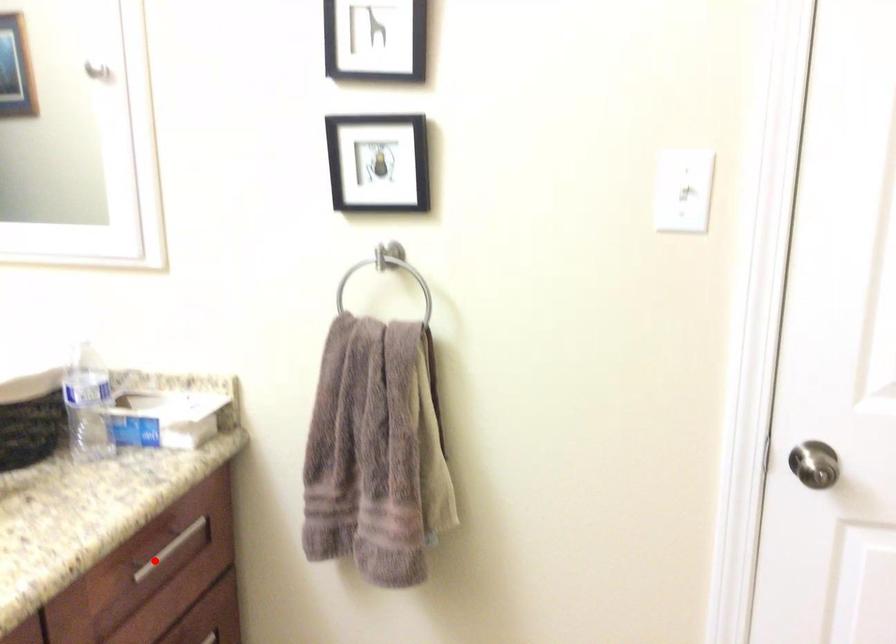
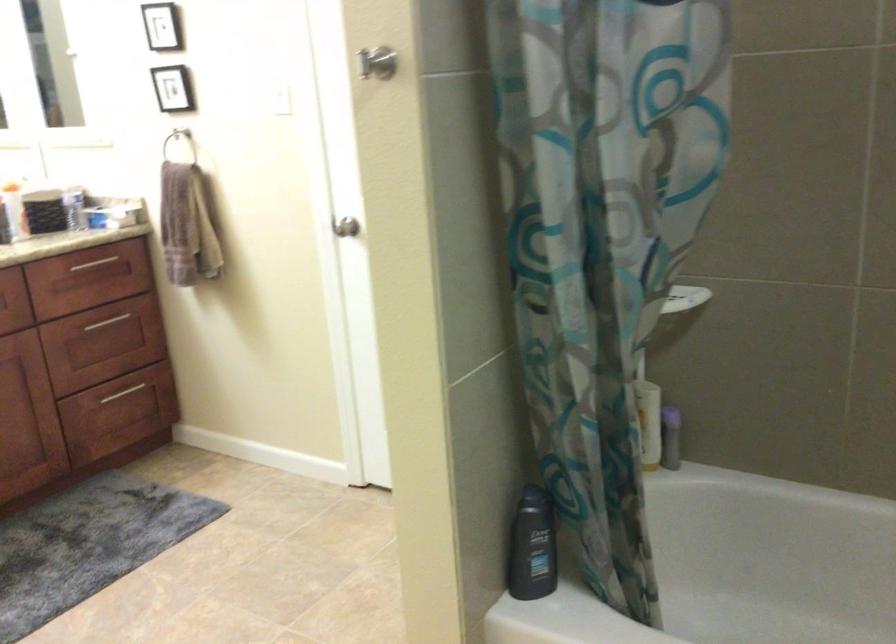
The point at the highlighted location is marked in the first image. Where is the corresponding point in the second image?

(92, 263)